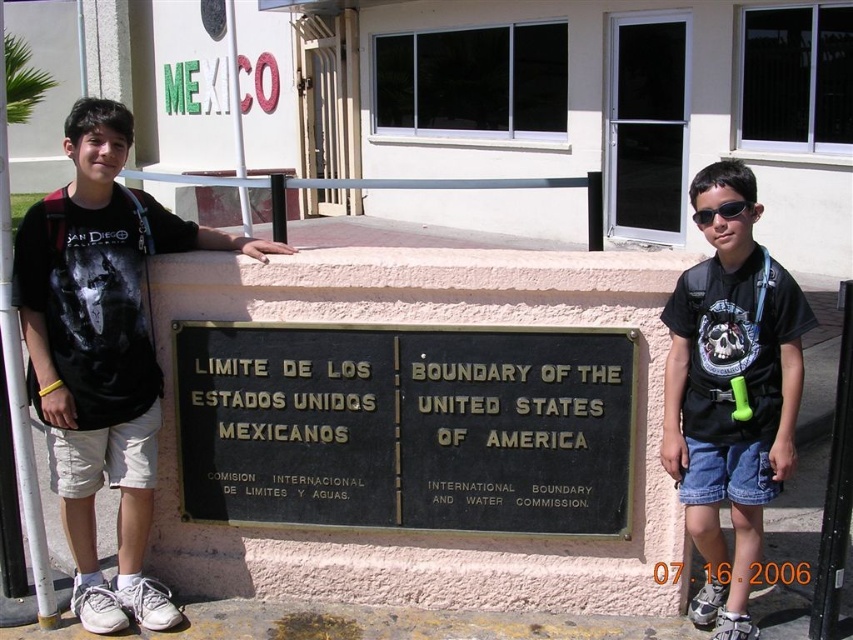
Question: Is black polished metal plaque at center bigger than black plastic sunglasses at center?

Choices:
 (A) yes
 (B) no

Answer: (A)

Question: Which point is farther from the camera taking this photo?

Choices:
 (A) (242, 426)
 (B) (701, 353)
 (C) (711, 220)
 (D) (125, 376)

Answer: (A)

Question: Which of the following is the closest to the observer?

Choices:
 (A) black polished metal plaque at center
 (B) black plastic sunglasses at center

Answer: (B)

Question: Is black matte t-shirt at left smaller than matte black t-shirt at center?

Choices:
 (A) yes
 (B) no

Answer: (B)

Question: Where is matte black t-shirt at center located in relation to black plastic sunglasses at center in the image?

Choices:
 (A) above
 (B) below

Answer: (B)

Question: Which of the following is the closest to the observer?

Choices:
 (A) (701, 624)
 (B) (695, 225)
 (C) (91, 282)

Answer: (C)